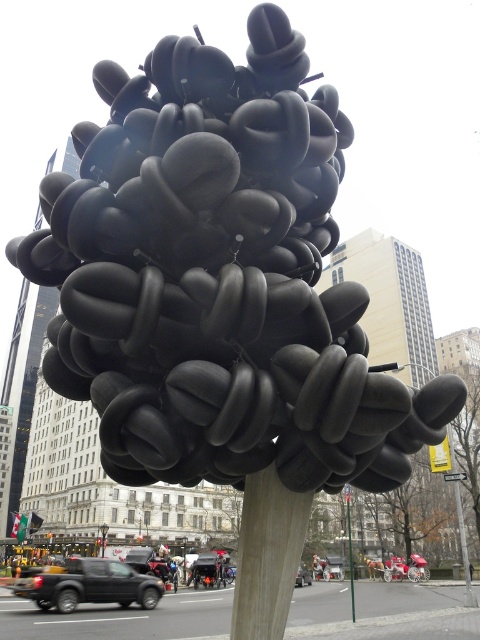
Does matte black sculpture at center have a lesser width compared to smooth gray pole at center?

No, matte black sculpture at center is not thinner than smooth gray pole at center.

Does matte black sculpture at center appear under smooth gray pole at center?

Actually, matte black sculpture at center is above smooth gray pole at center.

Does point (69, 304) come farther from viewer compared to point (348, 488)?

No.

Where is `matte black sculpture at center`? The image size is (480, 640). matte black sculpture at center is located at coordinates (219, 278).